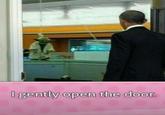
Where is `doorjam`? The width and height of the screenshot is (165, 115). doorjam is located at coordinates (17, 54).